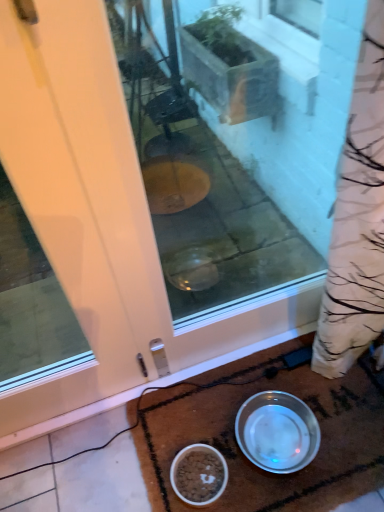
Where is `vacant space that is in between white glossy bowl at lower center, the second bowl from the right, and silver metallic bowl at lower center, which ranks as the 2th bowl in left-to-right order`? This screenshot has width=384, height=512. vacant space that is in between white glossy bowl at lower center, the second bowl from the right, and silver metallic bowl at lower center, which ranks as the 2th bowl in left-to-right order is located at coordinates (226, 451).